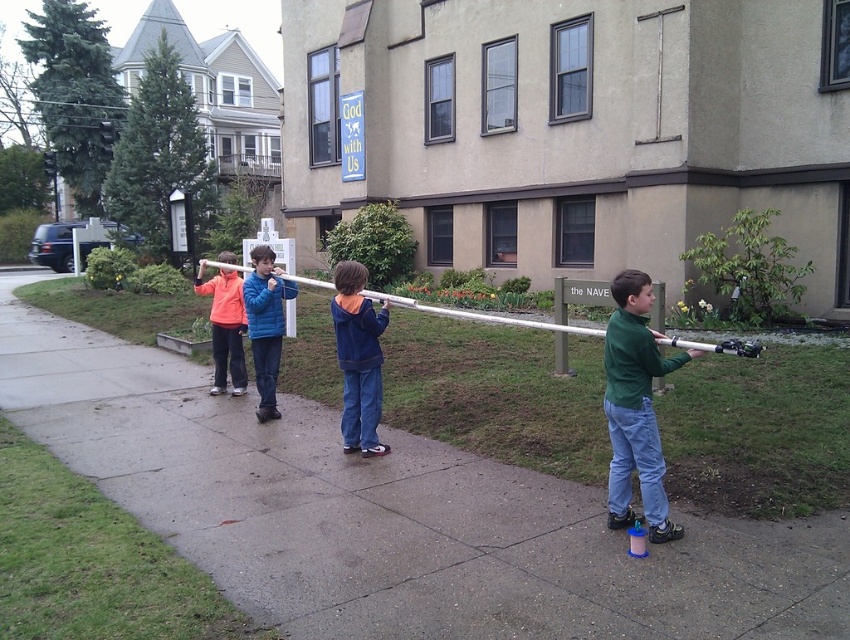
Question: Is navy blue hoodie at center to the left of silver metallic pole at center from the viewer's perspective?

Choices:
 (A) no
 (B) yes

Answer: (A)

Question: Is blue fleece jacket at center to the left of silver metallic pole at center from the viewer's perspective?

Choices:
 (A) no
 (B) yes

Answer: (B)

Question: Which point is farther from the camera taking this photo?

Choices:
 (A) (469, 316)
 (B) (620, 342)
 (C) (369, 320)
 (D) (270, 266)

Answer: (A)

Question: Is concrete at center to the right of orange fleece jacket at left from the viewer's perspective?

Choices:
 (A) no
 (B) yes

Answer: (B)

Question: Which object appears closest to the camera in this image?

Choices:
 (A) silver metallic pole at center
 (B) green matte shirt at right
 (C) orange fleece jacket at left
 (D) concrete at center

Answer: (D)

Question: Which of the following is the farthest from the observer?

Choices:
 (A) concrete at center
 (B) silver metallic pole at center
 (C) green matte shirt at right

Answer: (C)